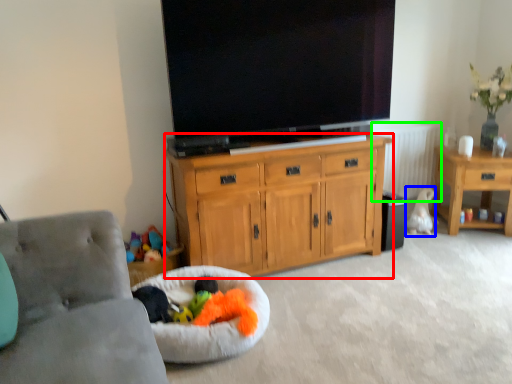
Question: Based on their relative distances, which object is farther from cabinetry (highlighted by a red box)? Choose from animal (highlighted by a blue box) and radiator (highlighted by a green box).

Choices:
 (A) animal
 (B) radiator

Answer: (A)